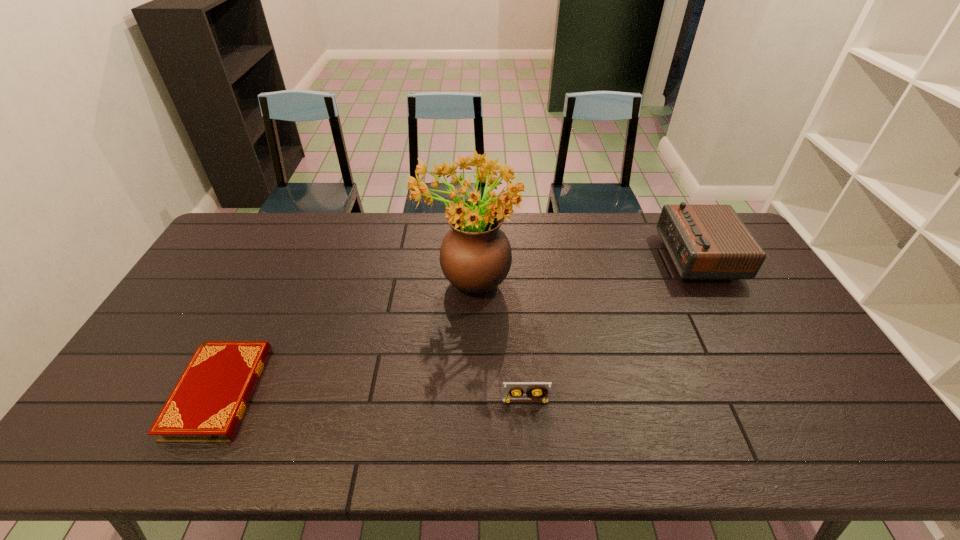
Where is `vacant position located at the front of the second shortest object with visible reels`? This screenshot has height=540, width=960. vacant position located at the front of the second shortest object with visible reels is located at coordinates (530, 449).

You are a GUI agent. You are given a task and a screenshot of the screen. Output one action in this format:
    pyautogui.click(x=<x>, y=<y>)
    Task: Click on the flower arrangement at the far edge
    The image size is (960, 540).
    Given the screenshot: What is the action you would take?
    pyautogui.click(x=475, y=256)

I want to click on radio receiver positioned at the far edge, so click(x=705, y=242).

You are a GUI agent. You are given a task and a screenshot of the screen. Output one action in this format:
    pyautogui.click(x=<x>, y=<y>)
    Task: Click on the object located at the near edge
    
    Given the screenshot: What is the action you would take?
    pyautogui.click(x=207, y=404)

The height and width of the screenshot is (540, 960). I want to click on object that is at the right edge, so click(705, 242).

Where is `object that is at the far right corner`? The width and height of the screenshot is (960, 540). object that is at the far right corner is located at coordinates (705, 242).

In the image, there is a desktop. At what (x,y) coordinates should I click in order to perform the action: click on vacant space at the far edge. Please return your answer as a coordinate pair (x, y). The image size is (960, 540). Looking at the image, I should click on (300, 225).

Locate an element on the screen. vacant area at the left edge is located at coordinates (197, 276).

In order to click on vacant space at the right edge of the desktop in this screenshot , I will do `click(848, 415)`.

In the image, there is a desktop. Where is `blank space at the near left corner`? The image size is (960, 540). blank space at the near left corner is located at coordinates (97, 448).